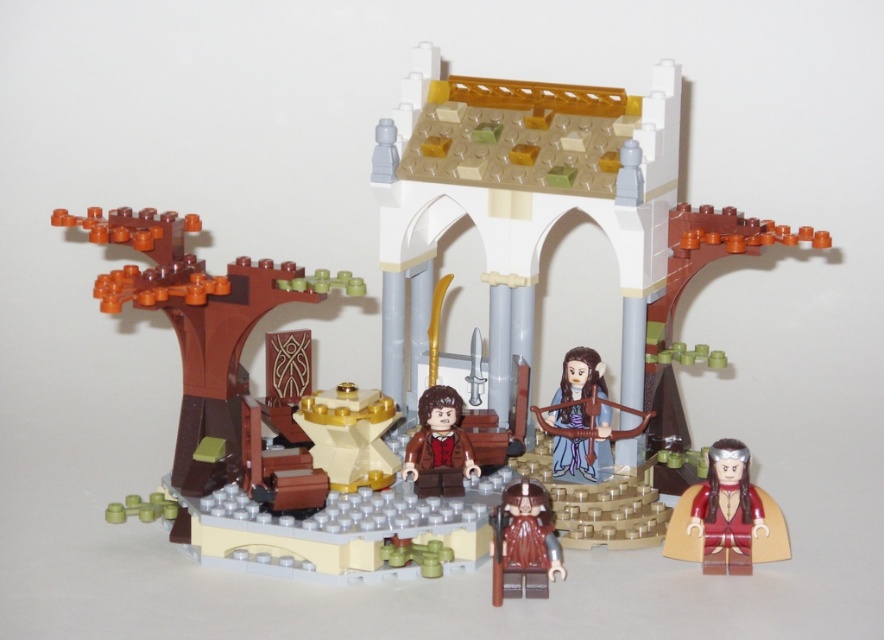
Question: Does smooth red cape at lower right have a larger size compared to brown matte minifigure at center?

Choices:
 (A) no
 (B) yes

Answer: (A)

Question: Which point is closer to the camera?

Choices:
 (A) (535, 545)
 (B) (581, 472)

Answer: (A)

Question: Does blue fabric bow at center have a larger size compared to brown matte jacket at center?

Choices:
 (A) no
 (B) yes

Answer: (B)

Question: Is brown matte minifigure at center in front of blue fabric bow at center?

Choices:
 (A) no
 (B) yes

Answer: (B)

Question: Which of these objects is positioned closest to the brown matte jacket at center?

Choices:
 (A) blue fabric bow at center
 (B) smooth red cape at lower right

Answer: (A)

Question: Which of the following is the farthest from the observer?

Choices:
 (A) (534, 497)
 (B) (745, 472)

Answer: (B)